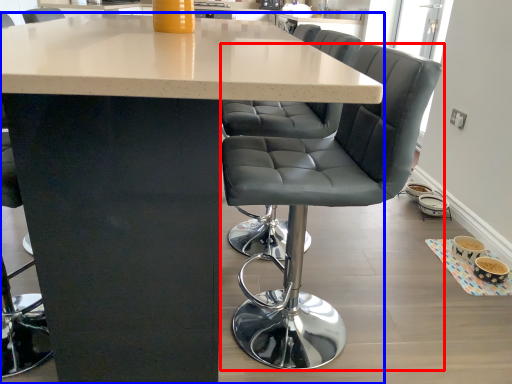
Question: Which point is closer to the camera, chair (highlighted by a red box) or table (highlighted by a blue box)?

Choices:
 (A) chair
 (B) table

Answer: (B)